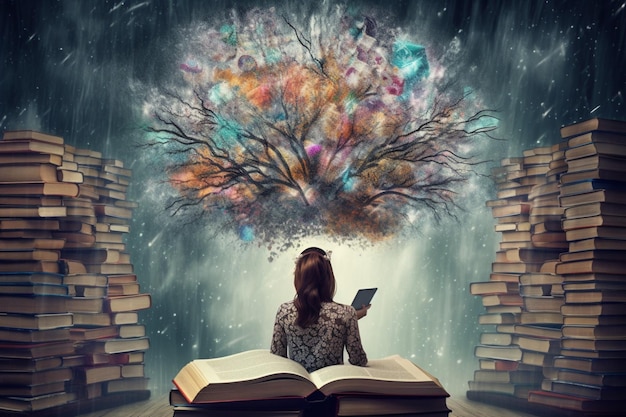
In order to click on digital device in this screenshot , I will do `click(364, 299)`.